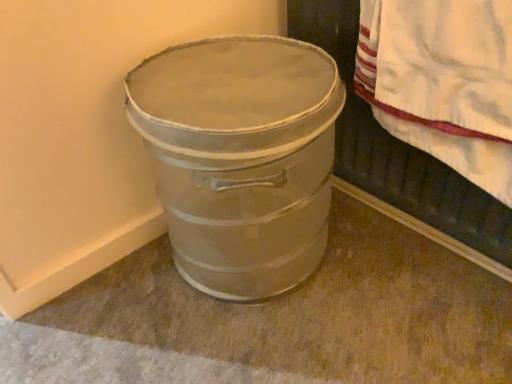
Question: From a real-world perspective, is metallic silver bucket at lower left positioned above or below metallic gray bucket at lower left?

Choices:
 (A) below
 (B) above

Answer: (A)

Question: Is metallic silver bucket at lower left situated inside metallic gray bucket at lower left or outside?

Choices:
 (A) outside
 (B) inside

Answer: (A)

Question: Which is nearer to the metallic silver bucket at lower left?

Choices:
 (A) white textured towel at upper right
 (B) metallic gray bucket at lower left

Answer: (B)

Question: Estimate the real-world distances between objects in this image. Which object is closer to the metallic gray bucket at lower left?

Choices:
 (A) metallic silver bucket at lower left
 (B) white textured towel at upper right

Answer: (B)